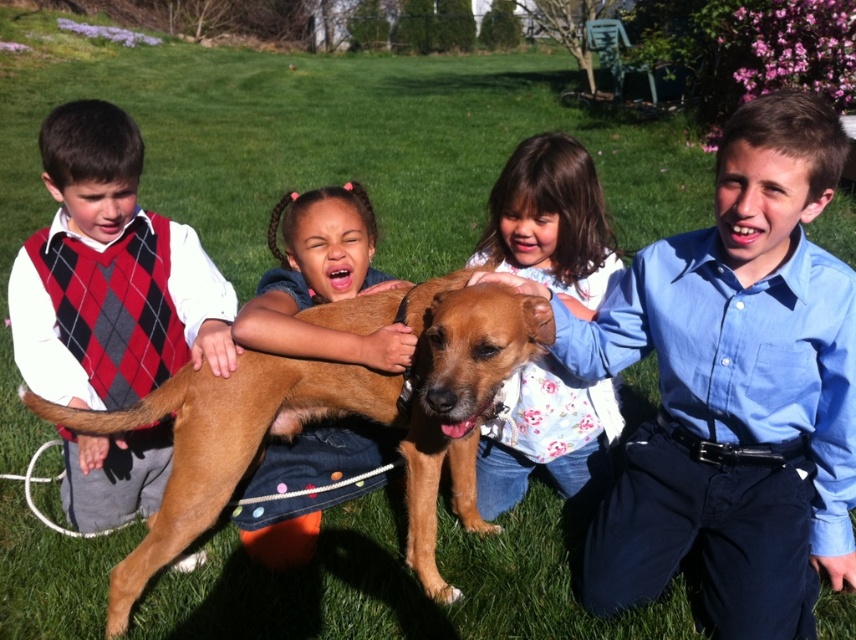
Between argyle sweater vest at left and fluffy white shirt at center, which one is positioned lower?

fluffy white shirt at center is lower down.

Which is above, argyle sweater vest at left or fluffy white shirt at center?

argyle sweater vest at left

The width and height of the screenshot is (856, 640). I want to click on argyle sweater vest at left, so click(x=110, y=275).

Can you confirm if brown furry dog at center is wider than fluffy white shirt at center?

Yes, brown furry dog at center is wider than fluffy white shirt at center.

Is brown furry dog at center further to camera compared to fluffy white shirt at center?

No, brown furry dog at center is in front of fluffy white shirt at center.

What do you see at coordinates (330, 417) in the screenshot?
I see `brown furry dog at center` at bounding box center [330, 417].

Locate an element on the screen. This screenshot has width=856, height=640. brown furry dog at center is located at coordinates (330, 417).

From the picture: Which is above, blue cotton shirt at right or brown furry dog at center?

Positioned higher is blue cotton shirt at right.

Who is positioned more to the right, blue cotton shirt at right or brown furry dog at center?

blue cotton shirt at right is more to the right.

Who is more distant from viewer, (822, 106) or (159, 552)?

Positioned behind is point (159, 552).

Image resolution: width=856 pixels, height=640 pixels. I want to click on blue cotton shirt at right, so click(735, 390).